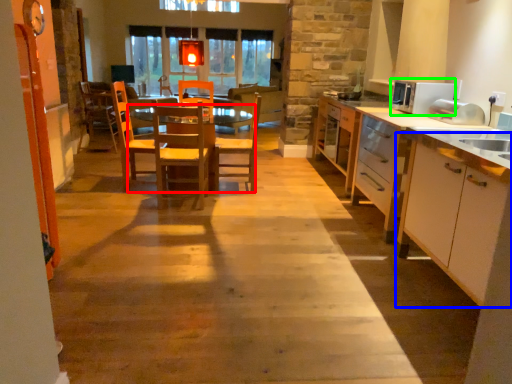
Question: Considering the real-world distances, which object is closest to table (highlighted by a red box)? cabinetry (highlighted by a blue box) or appliance (highlighted by a green box).

Choices:
 (A) cabinetry
 (B) appliance

Answer: (B)